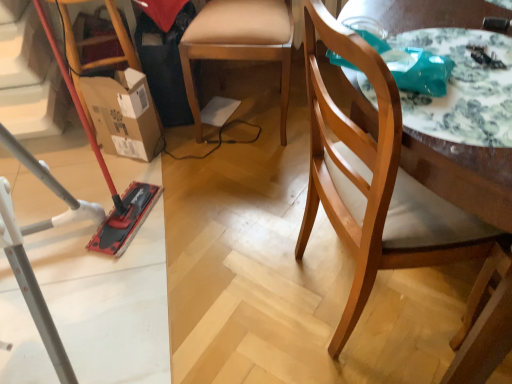
Where is `vacant space that is to the left of wooden chair at right, which is the first chair from front to back`? This screenshot has height=384, width=512. vacant space that is to the left of wooden chair at right, which is the first chair from front to back is located at coordinates (248, 291).